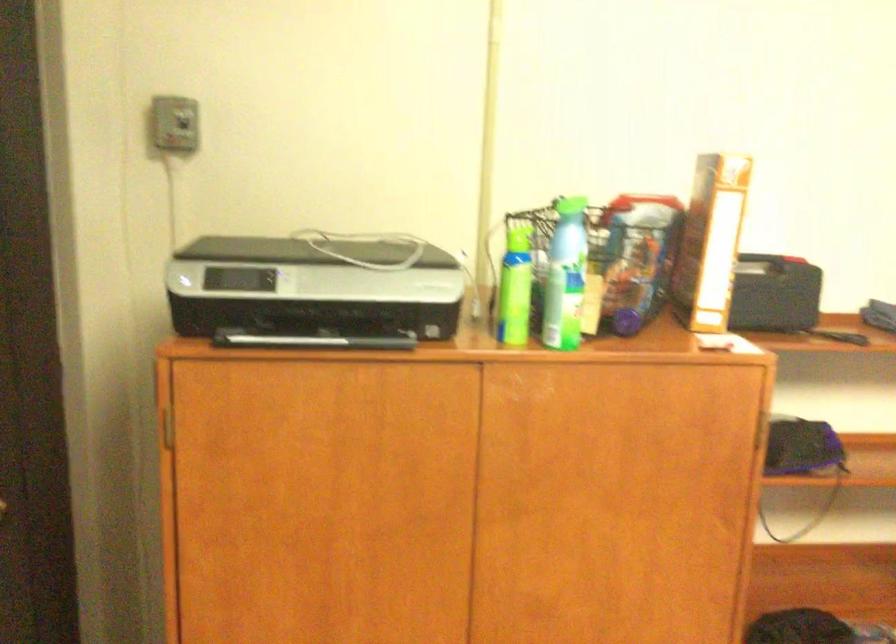
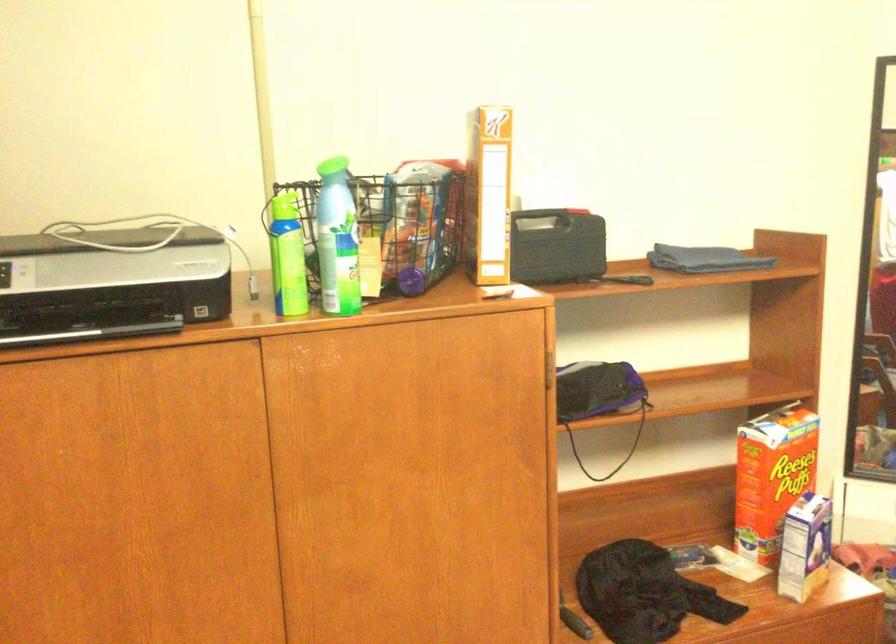
In the second image, find the point that corresponds to the point at 513,288 in the first image.

(288, 257)